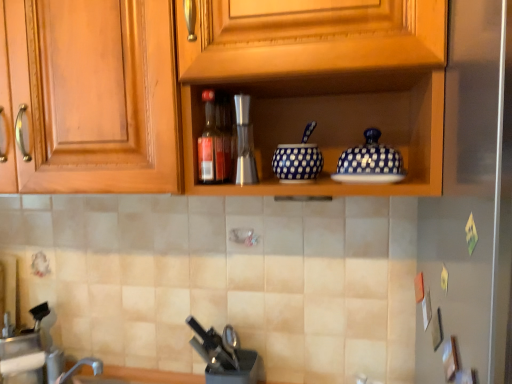
Question: Can you confirm if black plastic knife block at lower center is bigger than blue dotted bowl at center?

Choices:
 (A) no
 (B) yes

Answer: (B)

Question: Is blue dotted bowl at center completely or partially inside black plastic knife block at lower center?

Choices:
 (A) no
 (B) yes

Answer: (A)

Question: Is black plastic knife block at lower center closer to the viewer compared to blue dotted bowl at center?

Choices:
 (A) no
 (B) yes

Answer: (A)

Question: Is black plastic knife block at lower center oriented away from blue dotted bowl at center?

Choices:
 (A) yes
 (B) no

Answer: (B)

Question: Is black plastic knife block at lower center with blue dotted bowl at center?

Choices:
 (A) yes
 (B) no

Answer: (B)

Question: Is silver metallic coffee machine at center in front of or behind black plastic knife block at lower center in the image?

Choices:
 (A) behind
 (B) front

Answer: (B)

Question: From the image's perspective, is silver metallic coffee machine at center positioned above or below black plastic knife block at lower center?

Choices:
 (A) above
 (B) below

Answer: (A)

Question: Choose the correct answer: Is silver metallic coffee machine at center inside black plastic knife block at lower center or outside it?

Choices:
 (A) outside
 (B) inside

Answer: (A)

Question: Is point click(x=236, y=140) closer or farther from the camera than point click(x=225, y=347)?

Choices:
 (A) closer
 (B) farther

Answer: (A)

Question: Based on their sizes in the image, would you say brushed metal faucet at lower left is bigger or smaller than blue dotted bowl at center?

Choices:
 (A) small
 (B) big

Answer: (B)

Question: Relative to blue dotted bowl at center, is brushed metal faucet at lower left in front or behind?

Choices:
 (A) front
 (B) behind

Answer: (B)

Question: From a real-world perspective, is brushed metal faucet at lower left positioned above or below blue dotted bowl at center?

Choices:
 (A) below
 (B) above

Answer: (A)

Question: Visually, is brushed metal faucet at lower left positioned to the left or to the right of blue dotted bowl at center?

Choices:
 (A) left
 (B) right

Answer: (A)

Question: From the image's perspective, is blue polka dot ceramic bowl at upper right located above or below wooden cabinet at upper center?

Choices:
 (A) below
 (B) above

Answer: (A)

Question: From their relative heights in the image, would you say blue polka dot ceramic bowl at upper right is taller or shorter than wooden cabinet at upper center?

Choices:
 (A) tall
 (B) short

Answer: (B)